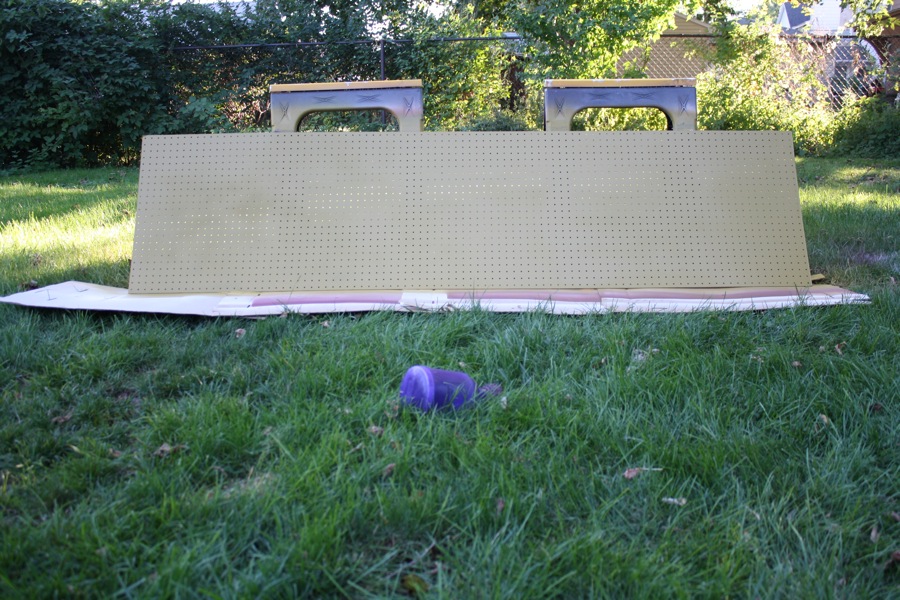
Where is `blue cannister`? blue cannister is located at coordinates (447, 391).